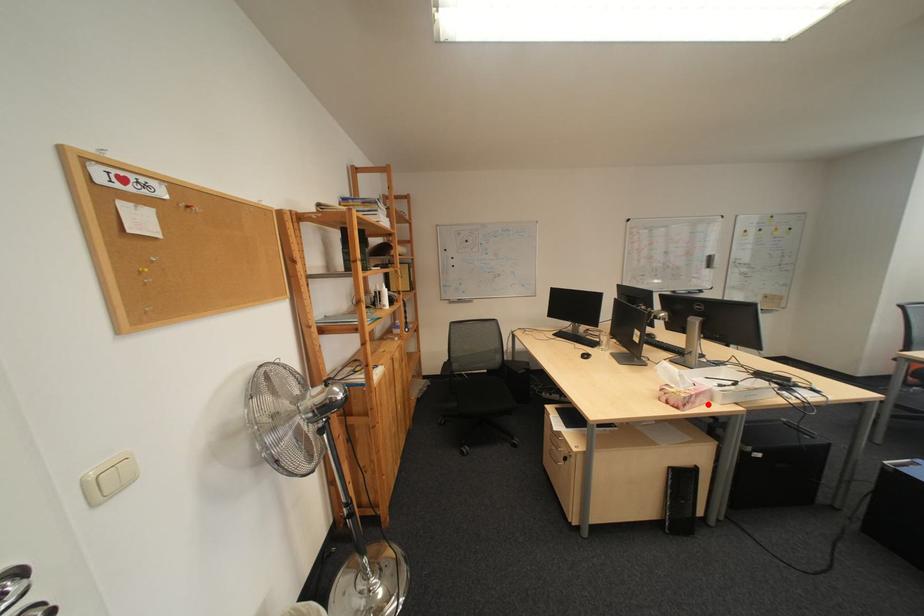
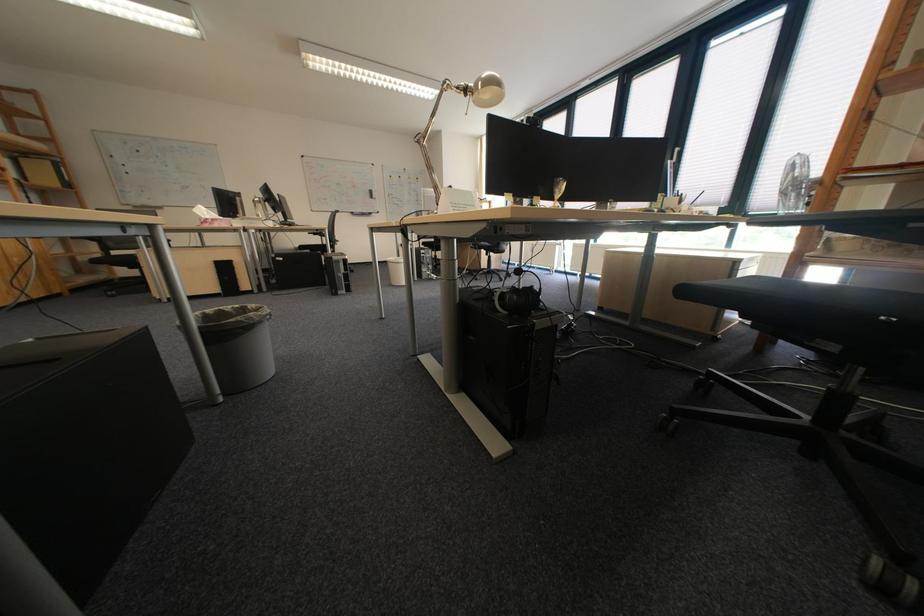
Find the pixel in the second image that matches the highlighted location in the first image.

(225, 225)